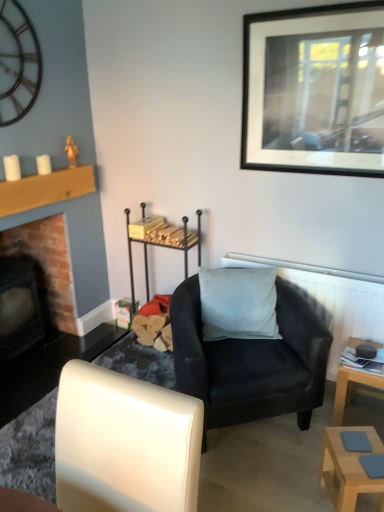
This screenshot has height=512, width=384. Identify the location of vacant region above black matte picture frame at upper right (from a real-world perspective). (307, 5).